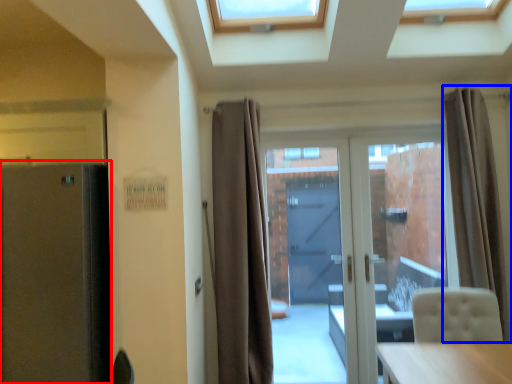
Question: Which object appears farthest to the camera in this image, fridge (highlighted by a red box) or curtain (highlighted by a blue box)?

Choices:
 (A) fridge
 (B) curtain

Answer: (B)